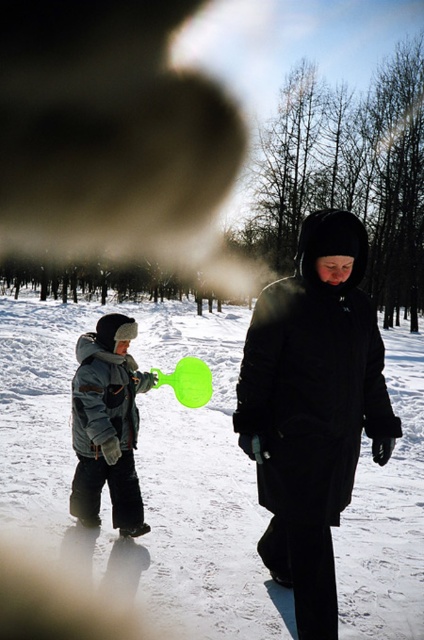
Question: Which point is closer to the camera?

Choices:
 (A) (229, 518)
 (B) (128, 452)

Answer: (B)

Question: Considering the relative positions of white fluffy snow at center and matte gray snowsuit at left in the image provided, where is white fluffy snow at center located with respect to matte gray snowsuit at left?

Choices:
 (A) left
 (B) right

Answer: (A)

Question: Observing the image, what is the correct spatial positioning of white fluffy snow at center in reference to matte gray snowsuit at left?

Choices:
 (A) right
 (B) left

Answer: (B)

Question: Among these points, which one is farthest from the camera?

Choices:
 (A) (39, 417)
 (B) (109, 378)

Answer: (A)

Question: Does white fluffy snow at center have a larger size compared to matte gray snowsuit at left?

Choices:
 (A) no
 (B) yes

Answer: (B)